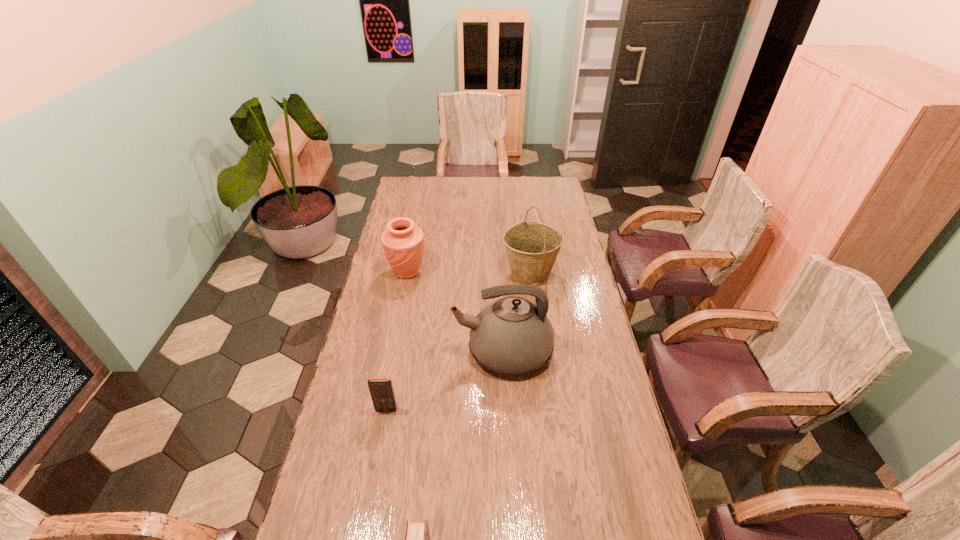
This screenshot has height=540, width=960. In order to click on vase located at the left edge in this screenshot , I will do `click(403, 243)`.

Image resolution: width=960 pixels, height=540 pixels. What are the coordinates of `cellular telephone present at the left edge` in the screenshot? It's located at (381, 390).

The width and height of the screenshot is (960, 540). Find the location of `object situated at the right edge`. object situated at the right edge is located at coordinates (532, 247).

You are a GUI agent. You are given a task and a screenshot of the screen. Output one action in this format:
    pyautogui.click(x=<x>, y=<y>)
    Task: Click on the vacant space at the far edge
    Image resolution: width=960 pixels, height=540 pixels.
    Given the screenshot: What is the action you would take?
    pyautogui.click(x=439, y=183)

At what (x,y) coordinates should I click in order to perform the action: click on free point at the left edge. Please return your answer as a coordinate pair (x, y). Looking at the image, I should click on (391, 269).

This screenshot has height=540, width=960. Find the location of `blank space at the right edge`. blank space at the right edge is located at coordinates (590, 481).

Identify the location of vacant space in between the wine bucket and the vase. (468, 273).

Locate an element on the screen. vacant area that lies between the vase and the fourth farthest object is located at coordinates (396, 341).

The height and width of the screenshot is (540, 960). What are the coordinates of `vacant area between the cellular telephone and the third tallest object` in the screenshot? It's located at pos(396,341).

Locate an element on the screen. This screenshot has width=960, height=540. vacant area between the third shortest object and the second nearest object is located at coordinates (396, 341).